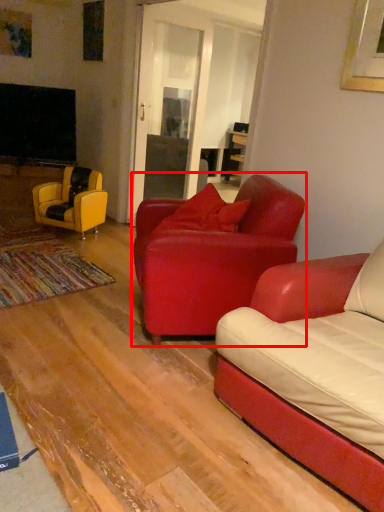
Question: Where is chair (annotated by the red box) located in relation to chair in the image?

Choices:
 (A) right
 (B) left

Answer: (A)